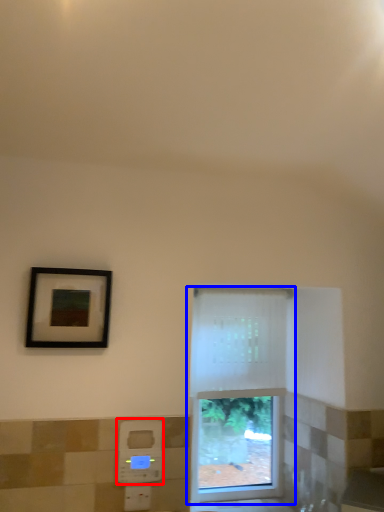
Question: Which point is further to the camera, hand dryer (highlighted by a red box) or window (highlighted by a blue box)?

Choices:
 (A) hand dryer
 (B) window

Answer: (B)